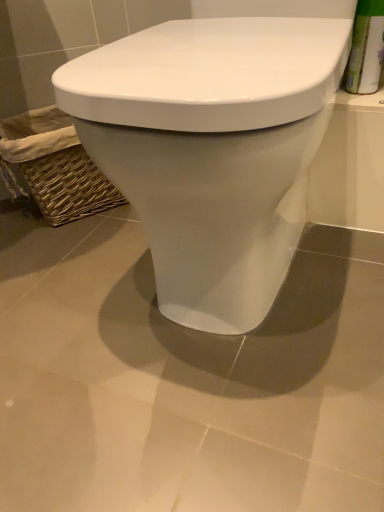
Question: Is woven brown basket at lower left bigger than white glossy toilet at center?

Choices:
 (A) no
 (B) yes

Answer: (A)

Question: Can you confirm if woven brown basket at lower left is wider than white glossy toilet at center?

Choices:
 (A) yes
 (B) no

Answer: (B)

Question: Can white glossy toilet at center be found inside woven brown basket at lower left?

Choices:
 (A) yes
 (B) no

Answer: (B)

Question: Is there a large distance between woven brown basket at lower left and white glossy toilet at center?

Choices:
 (A) no
 (B) yes

Answer: (A)

Question: Is woven brown basket at lower left closer to the viewer compared to white glossy toilet at center?

Choices:
 (A) yes
 (B) no

Answer: (B)

Question: Considering the relative positions of woven brown basket at lower left and white glossy toilet at center in the image provided, is woven brown basket at lower left behind white glossy toilet at center?

Choices:
 (A) yes
 (B) no

Answer: (A)

Question: Is white glossy toilet at center facing away from woven brown basket at lower left?

Choices:
 (A) yes
 (B) no

Answer: (B)

Question: Considering the relative sizes of white glossy toilet at center and woven brown basket at lower left in the image provided, is white glossy toilet at center wider than woven brown basket at lower left?

Choices:
 (A) yes
 (B) no

Answer: (A)

Question: Is white glossy toilet at center closer to camera compared to woven brown basket at lower left?

Choices:
 (A) yes
 (B) no

Answer: (A)

Question: Is white glossy toilet at center to the left of woven brown basket at lower left from the viewer's perspective?

Choices:
 (A) no
 (B) yes

Answer: (A)

Question: Considering the relative positions of white glossy toilet at center and woven brown basket at lower left in the image provided, is white glossy toilet at center to the right of woven brown basket at lower left from the viewer's perspective?

Choices:
 (A) no
 (B) yes

Answer: (B)

Question: Considering the relative sizes of white glossy toilet at center and woven brown basket at lower left in the image provided, is white glossy toilet at center bigger than woven brown basket at lower left?

Choices:
 (A) no
 (B) yes

Answer: (B)

Question: From a real-world perspective, is white glossy toilet at center positioned above or below woven brown basket at lower left?

Choices:
 (A) above
 (B) below

Answer: (A)